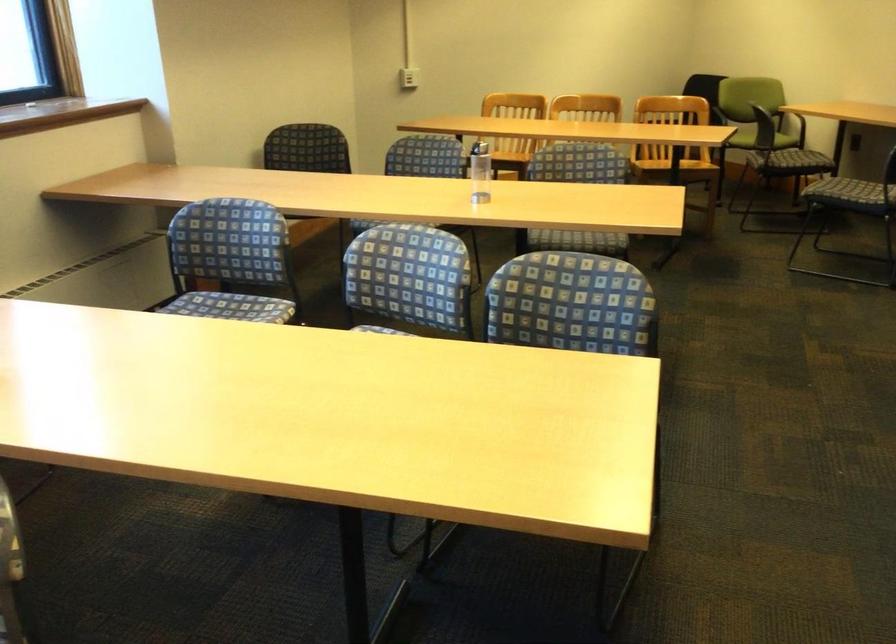
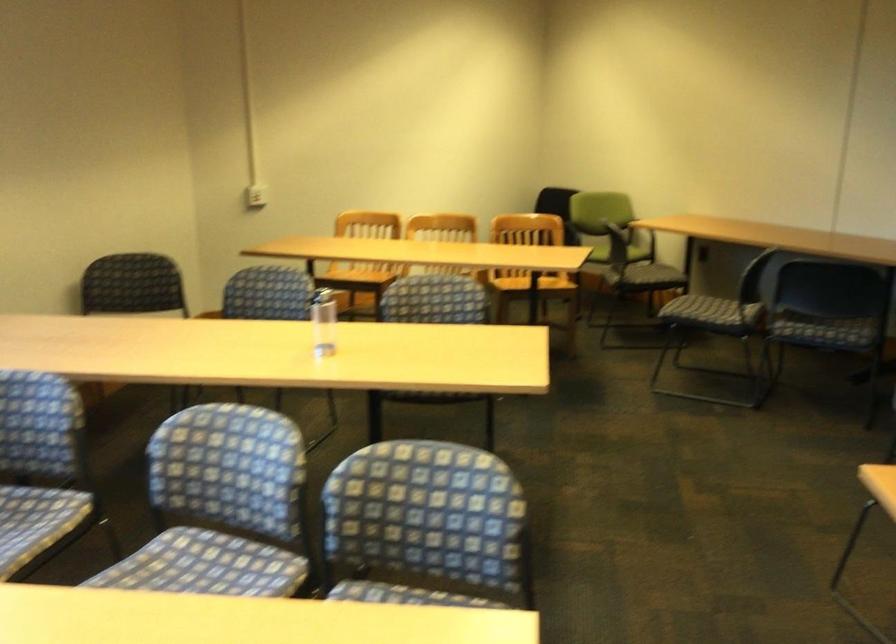
Locate, in the second image, the point that corresponds to pixel 570 317 in the first image.

(425, 527)